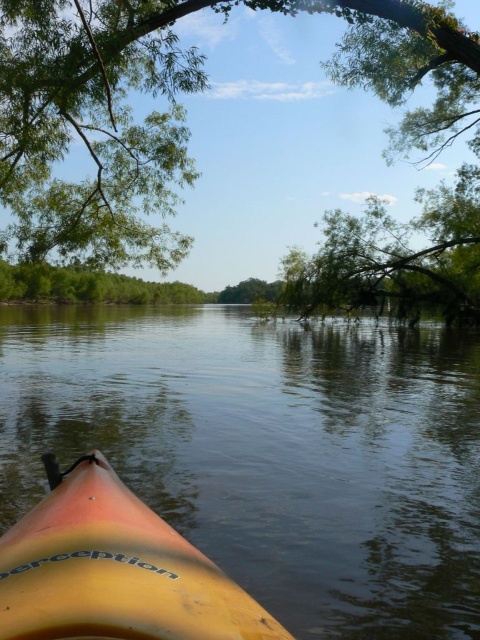
Which is in front, point (310, 352) or point (28, 220)?

Positioned in front is point (28, 220).

What are the coordinates of `yellow plastic kayak at lower left` in the screenshot? It's located at (269, 451).

Who is more distant from viewer, [58,200] or [177,621]?

Positioned behind is point [58,200].

Image resolution: width=480 pixels, height=640 pixels. I want to click on green leafy tree at upper center, so click(x=179, y=108).

Which is behind, point (262, 404) or point (176, 620)?

The point (262, 404) is behind.

Who is more distant from viewer, (x=396, y=388) or (x=57, y=621)?

The point (x=396, y=388) is more distant.

Where is `yellow plastic kayak at lower left`? Image resolution: width=480 pixels, height=640 pixels. yellow plastic kayak at lower left is located at coordinates click(x=269, y=451).